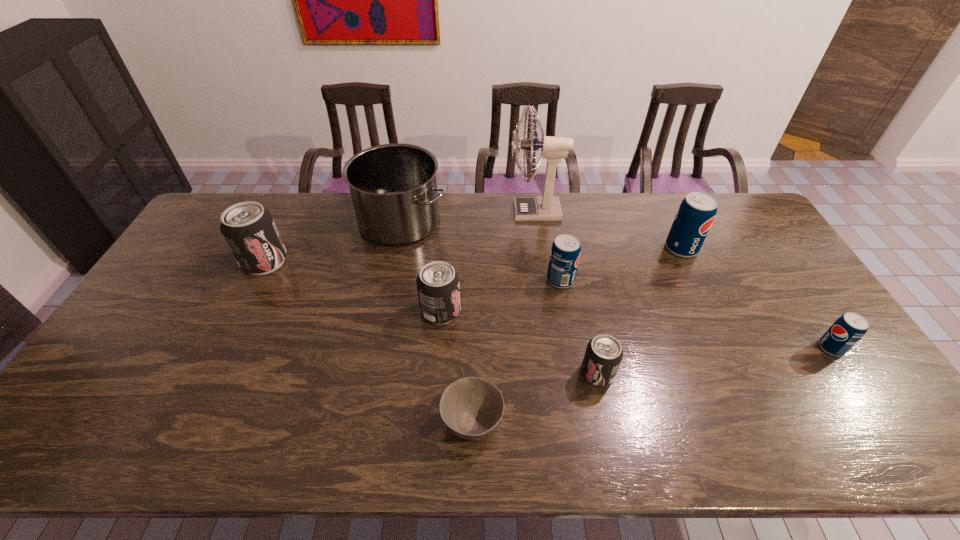
This screenshot has height=540, width=960. What are the coordinates of `blank region between the smallest blue pop and the nearest object` in the screenshot? It's located at (652, 385).

Locate an element on the screen. The image size is (960, 540). vacant space that is in between the leftmost object and the fourth nearest object is located at coordinates (352, 286).

Where is `vacant area that lies between the farthest black soda can and the second smallest blue pop`? vacant area that lies between the farthest black soda can and the second smallest blue pop is located at coordinates (413, 271).

Where is `vacant space in between the shortest object and the second object from right to left`? The height and width of the screenshot is (540, 960). vacant space in between the shortest object and the second object from right to left is located at coordinates (577, 335).

At what (x,y) coordinates should I click in order to perform the action: click on object that can be found as the closest to the farthest blue pop. Please return your answer as a coordinate pair (x, y). Image resolution: width=960 pixels, height=540 pixels. Looking at the image, I should click on [x=546, y=208].

Image resolution: width=960 pixels, height=540 pixels. In order to click on object that is the seventh nearest to the fifth soda can from left to right in this screenshot , I will do `click(471, 408)`.

Identify which soda can is the second closest to the seventh farthest object. Please provide its 2D coordinates. Your answer should be formatted as a tuple, i.e. [(x, y)], where the tuple contains the x and y coordinates of a point satisfying the conditions above.

[(603, 355)]

Identify which soda can is located as the nearest to the eighth farthest object. Please provide its 2D coordinates. Your answer should be formatted as a tuple, i.e. [(x, y)], where the tuple contains the x and y coordinates of a point satisfying the conditions above.

[(565, 253)]

Select which blue pop is the closest to the second blue pop from right to left. Please provide its 2D coordinates. Your answer should be formatted as a tuple, i.e. [(x, y)], where the tuple contains the x and y coordinates of a point satisfying the conditions above.

[(565, 253)]

Locate an element on the screen. This screenshot has width=960, height=540. blue pop that stands as the third closest to the rightmost black soda can is located at coordinates (848, 329).